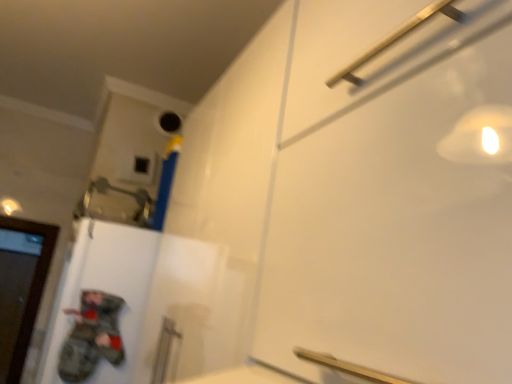
Describe the element at coordinates (91, 336) in the screenshot. This screenshot has height=384, width=512. I see `camouflage fabric pants at lower left` at that location.

Looking at this image, what is the approximate width of camouflage fabric pants at lower left?

It is 1.47 inches.

Identify the location of camouflage fabric pants at lower left. (91, 336).

In order to face camouflage fabric pants at lower left, should I rotate leftwards or rightwards?

Rotate your view left by about 20.487°.

Measure the distance between point (53, 234) and camera.

Point (53, 234) and camera are 2.46 meters apart from each other.

Describe the element at coordinates (21, 287) in the screenshot. I see `wooden door at left` at that location.

The height and width of the screenshot is (384, 512). I want to click on wooden door at left, so click(21, 287).

The height and width of the screenshot is (384, 512). Find the location of `camouflage fabric pants at lower left`. camouflage fabric pants at lower left is located at coordinates (91, 336).

Is wooden door at left at the left side of camouflage fabric pants at lower left?

Indeed, wooden door at left is positioned on the left side of camouflage fabric pants at lower left.

Does wooden door at left lie behind camouflage fabric pants at lower left?

Yes, wooden door at left is behind camouflage fabric pants at lower left.

Does point (15, 314) come closer to viewer compared to point (78, 320)?

No.

From the image's perspective, who appears lower, wooden door at left or camouflage fabric pants at lower left?

wooden door at left, from the image's perspective.

Based on the photo, from a real-world perspective, is wooden door at left positioned over camouflage fabric pants at lower left based on gravity?

Incorrect, from a real-world perspective, wooden door at left is lower than camouflage fabric pants at lower left.

Can you confirm if wooden door at left is thinner than camouflage fabric pants at lower left?

No.

Can you confirm if wooden door at left is shorter than camouflage fabric pants at lower left?

In fact, wooden door at left may be taller than camouflage fabric pants at lower left.

Between wooden door at left and camouflage fabric pants at lower left, which one has smaller size?

Smaller between the two is camouflage fabric pants at lower left.

From the picture: Is wooden door at left surrounding camouflage fabric pants at lower left?

No, wooden door at left does not contain camouflage fabric pants at lower left.

Is wooden door at left not close to camouflage fabric pants at lower left?

Absolutely, wooden door at left is distant from camouflage fabric pants at lower left.

Is camouflage fabric pants at lower left at the back of wooden door at left?

wooden door at left is not turned away from camouflage fabric pants at lower left.

Image resolution: width=512 pixels, height=384 pixels. Find the location of `person in front of the wooden door at left`. person in front of the wooden door at left is located at coordinates coord(91,336).

Between camouflage fabric pants at lower left and wooden door at left, which one appears on the left side from the viewer's perspective?

wooden door at left.

Is camouflage fabric pants at lower left positioned behind wooden door at left?

No, it is in front of wooden door at left.

Considering the points (104, 327) and (3, 280), which point is in front, point (104, 327) or point (3, 280)?

The point (104, 327) is closer to the camera.

From the image's perspective, would you say camouflage fabric pants at lower left is shown under wooden door at left?

No, from the image's perspective, camouflage fabric pants at lower left is not beneath wooden door at left.

From a real-world perspective, is camouflage fabric pants at lower left under wooden door at left?

No, from a real-world perspective, camouflage fabric pants at lower left is not below wooden door at left.

Considering the relative sizes of camouflage fabric pants at lower left and wooden door at left in the image provided, is camouflage fabric pants at lower left wider than wooden door at left?

Incorrect, the width of camouflage fabric pants at lower left does not surpass that of wooden door at left.

Who is shorter, camouflage fabric pants at lower left or wooden door at left?

With less height is camouflage fabric pants at lower left.

Considering the sizes of objects camouflage fabric pants at lower left and wooden door at left in the image provided, who is bigger, camouflage fabric pants at lower left or wooden door at left?

Bigger between the two is wooden door at left.

Is wooden door at left a part of camouflage fabric pants at lower left?

No, wooden door at left is located outside of camouflage fabric pants at lower left.

Is the surface of camouflage fabric pants at lower left in direct contact with wooden door at left?

No, camouflage fabric pants at lower left is not beside wooden door at left.

Is camouflage fabric pants at lower left facing towards wooden door at left?

No, camouflage fabric pants at lower left is not facing towards wooden door at left.

Where is `door that is behind the camouflage fabric pants at lower left`? door that is behind the camouflage fabric pants at lower left is located at coordinates (21, 287).

In the image, there is a camouflage fabric pants at lower left. Where is `door below it (from the image's perspective)`? door below it (from the image's perspective) is located at coordinates (21, 287).

The width and height of the screenshot is (512, 384). Identify the location of person in front of the wooden door at left. (91, 336).